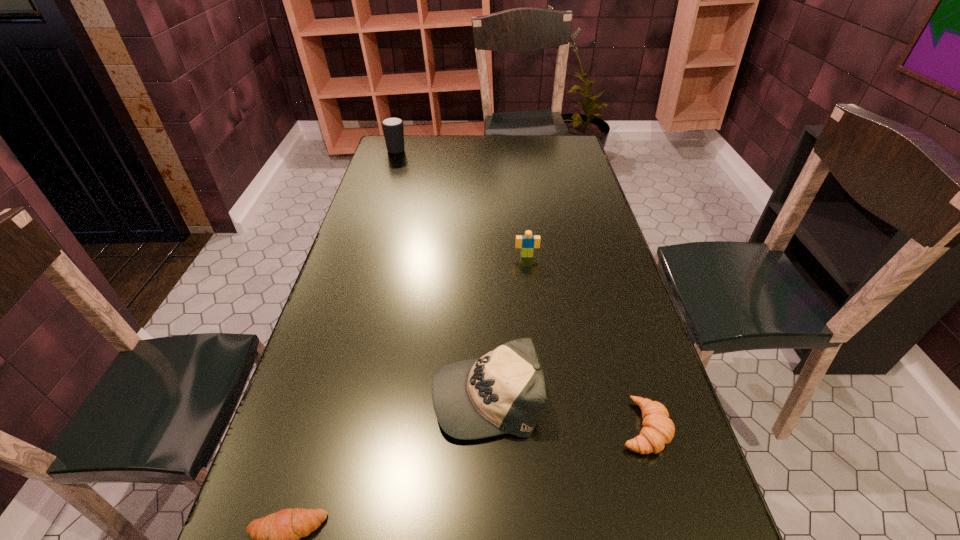
This screenshot has width=960, height=540. Identify the location of vacant position located 0.060m on the back of the farther crescent roll. (628, 376).

Locate an element on the screen. Image resolution: width=960 pixels, height=540 pixels. object that is at the far edge is located at coordinates (393, 129).

The width and height of the screenshot is (960, 540). I want to click on object that is positioned at the left edge, so click(x=393, y=129).

Identify the location of object at the right edge. pos(658,430).

This screenshot has height=540, width=960. Identify the location of object positioned at the far left corner. (393, 129).

Image resolution: width=960 pixels, height=540 pixels. Find the location of `free space at the far edge of the desktop`. free space at the far edge of the desktop is located at coordinates pos(452,161).

Where is `vacant space at the left edge of the desktop`? This screenshot has height=540, width=960. vacant space at the left edge of the desktop is located at coordinates (369, 195).

Identify the location of free region at the right edge of the desktop. This screenshot has width=960, height=540. (600, 347).

Image resolution: width=960 pixels, height=540 pixels. In the image, there is a desktop. In order to click on vacant space at the far left corner in this screenshot , I will do `click(409, 137)`.

The width and height of the screenshot is (960, 540). What are the coordinates of `vacant area between the second farthest object and the farther crescent roll` in the screenshot? It's located at (585, 341).